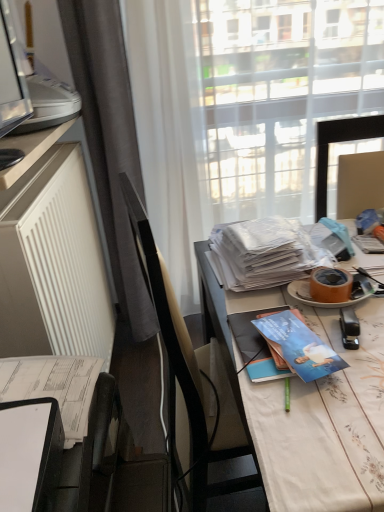
Find the location of a particular element. The height and width of the screenshot is (512, 384). free space between blue glossy book at center and orange matte plate at right is located at coordinates (334, 325).